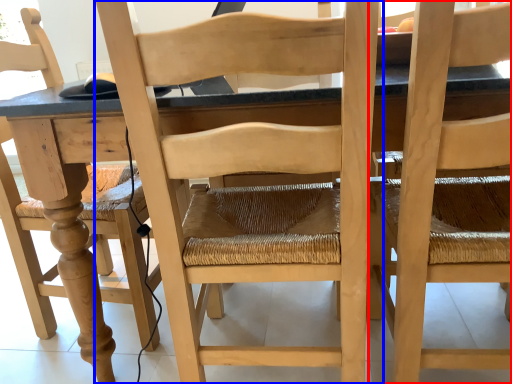
Question: Which object is closer to the camera taking this photo, chair (highlighted by a red box) or chair (highlighted by a blue box)?

Choices:
 (A) chair
 (B) chair

Answer: (A)